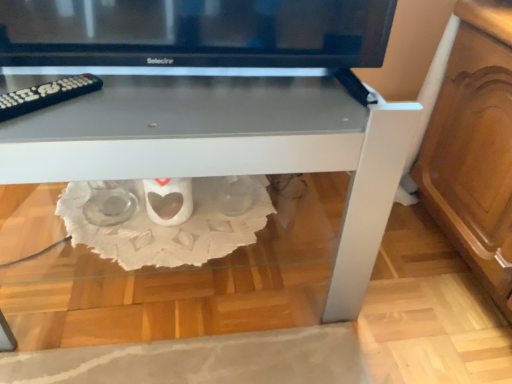
Question: Is white glossy table at center not near black plastic remote at left?

Choices:
 (A) no
 (B) yes

Answer: (A)

Question: Is white glossy table at center directly adjacent to black plastic remote at left?

Choices:
 (A) yes
 (B) no

Answer: (B)

Question: From a real-world perspective, is white glossy table at center on black plastic remote at left?

Choices:
 (A) no
 (B) yes

Answer: (A)

Question: Would you say black plastic remote at left is part of white glossy table at center's contents?

Choices:
 (A) yes
 (B) no

Answer: (A)

Question: Is white glossy table at center positioned before black plastic remote at left?

Choices:
 (A) no
 (B) yes

Answer: (B)

Question: Can you confirm if white glossy table at center is positioned to the right of black plastic remote at left?

Choices:
 (A) yes
 (B) no

Answer: (A)

Question: From the image's perspective, is black plastic remote at left beneath white glossy table at center?

Choices:
 (A) yes
 (B) no

Answer: (B)

Question: Can you confirm if black plastic remote at left is positioned to the left of white glossy table at center?

Choices:
 (A) no
 (B) yes

Answer: (B)

Question: Is black plastic remote at left oriented away from white glossy table at center?

Choices:
 (A) yes
 (B) no

Answer: (A)

Question: Can you confirm if black plastic remote at left is positioned to the right of white glossy table at center?

Choices:
 (A) no
 (B) yes

Answer: (A)

Question: Is black plastic remote at left bigger than white glossy table at center?

Choices:
 (A) yes
 (B) no

Answer: (B)

Question: Does black plastic remote at left contain white glossy table at center?

Choices:
 (A) yes
 (B) no

Answer: (B)

Question: From a real-world perspective, is black plastic remote at left physically located above or below white glossy table at center?

Choices:
 (A) below
 (B) above

Answer: (B)